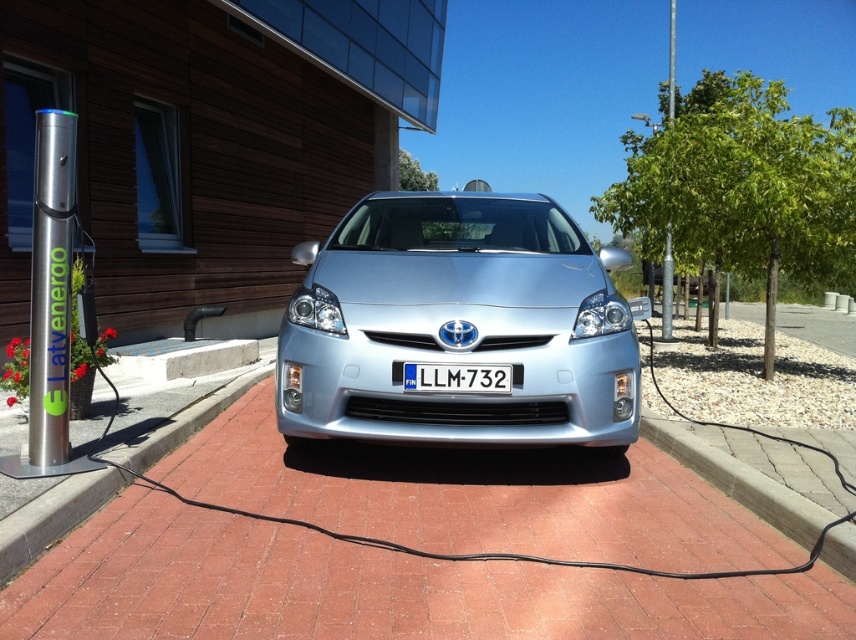
Which is more to the right, silver brick pavement at center or brick at lower left?

silver brick pavement at center is more to the right.

Between silver brick pavement at center and brick at lower left, which one is positioned higher?

brick at lower left is above.

Find the location of `silver brick pavement at center`. silver brick pavement at center is located at coordinates 369,589.

Does silver metallic pole at left have a smaller size compared to brick at lower left?

Yes.

Between point (40, 422) and point (22, 566), which one is positioned behind?

Point (40, 422)

This screenshot has height=640, width=856. What do you see at coordinates (51, 285) in the screenshot?
I see `silver metallic pole at left` at bounding box center [51, 285].

This screenshot has height=640, width=856. I want to click on silver metallic pole at left, so click(51, 285).

Which is behind, point (562, 276) or point (444, 372)?

The point (562, 276) is behind.

Does satin silver car at center appear under white plastic license plate at center?

No.

This screenshot has width=856, height=640. What do you see at coordinates (456, 324) in the screenshot?
I see `satin silver car at center` at bounding box center [456, 324].

This screenshot has width=856, height=640. What are the coordinates of `satin silver car at center` in the screenshot? It's located at (456, 324).